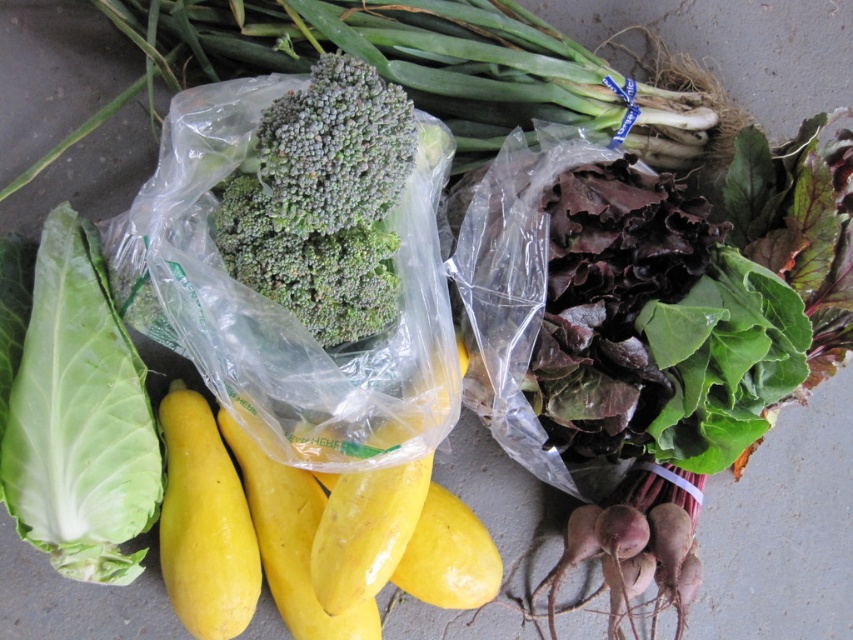
You are standing at the center of the vegetable display. There are two points marked as point [355,195] and point [369,628]. Which point is closer to you?

Point [355,195] is in front of point [369,628], so it is closer to you.